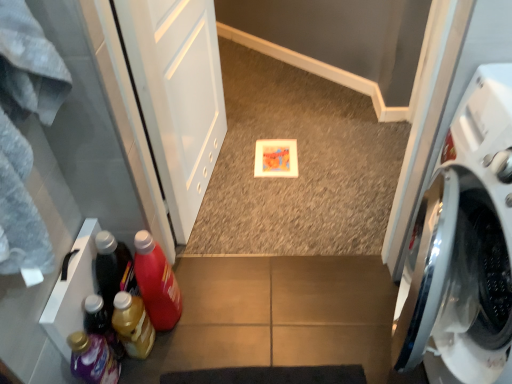
Where is `vacant region in front of white glossy screen door at upper left`? vacant region in front of white glossy screen door at upper left is located at coordinates (236, 216).